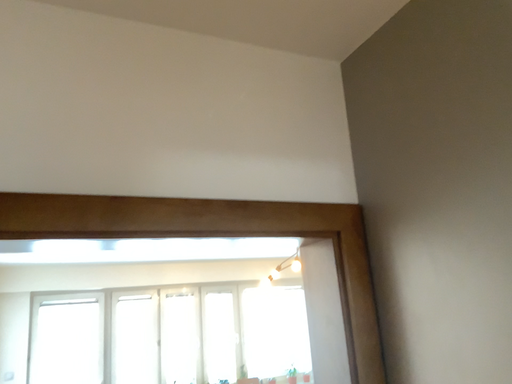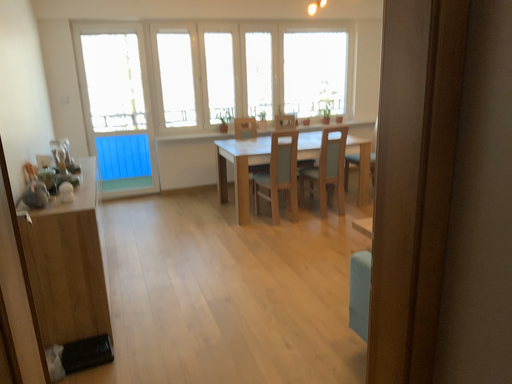
Question: How did the camera likely rotate when shooting the video?

Choices:
 (A) rotated downward
 (B) rotated upward

Answer: (A)